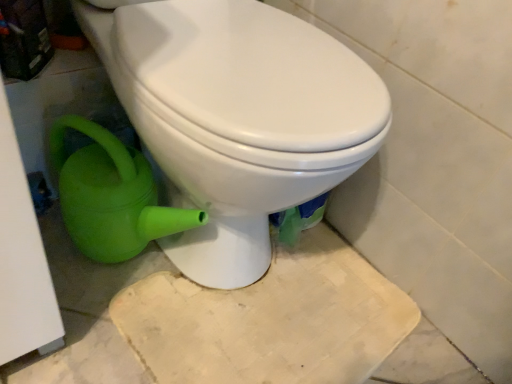
The height and width of the screenshot is (384, 512). I want to click on white glossy toilet at center, so click(x=237, y=117).

The image size is (512, 384). Describe the element at coordinates (237, 117) in the screenshot. I see `white glossy toilet at center` at that location.

At what (x,y) coordinates should I click in order to perform the action: click on white glossy toilet at center. Please return your answer as a coordinate pair (x, y). Looking at the image, I should click on (237, 117).